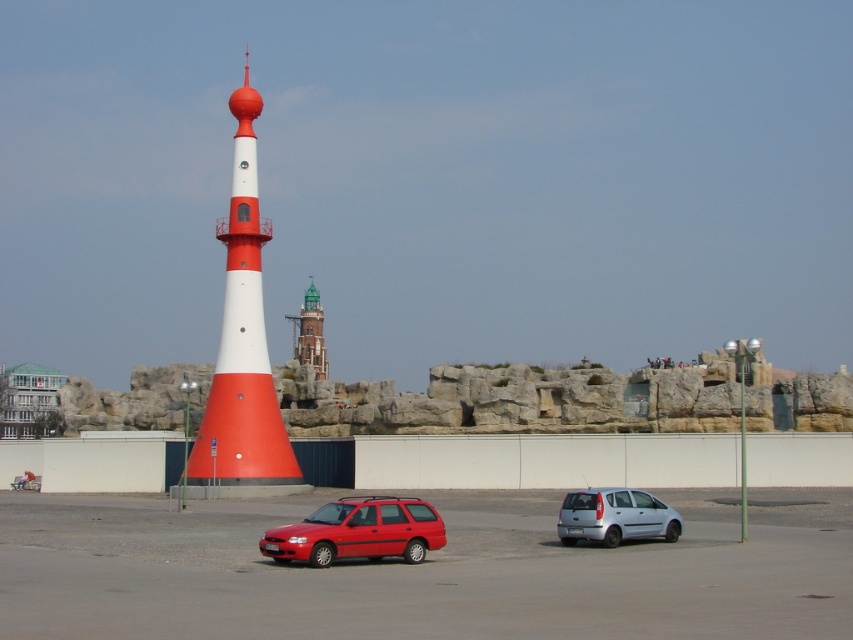
You are a delivery driver who needs to park your truck between the smooth orange cone at center and the shiny red station wagon at center. Is there enough space for your truck which is 6 meters long?

The smooth orange cone at center is positioned on the left side of the shiny red station wagon at center, but the exact distance between them isn

You are a delivery driver who needs to park your truck, which is 12 meters long, in the smooth asphalt parking lot at center. Can you fit your truck in the parking lot?

The smooth asphalt parking lot at center is 33.61 meters from camera, so the truck of 12 meters length can fit in the parking lot as the distance is more than sufficient.

You are a tourist standing at the entrance of the parking area. You see the shiny red station wagon at center and the green glass tower at center. Which object is closer to you?

The shiny red station wagon at center is closer to you because it is in front of the green glass tower at center.